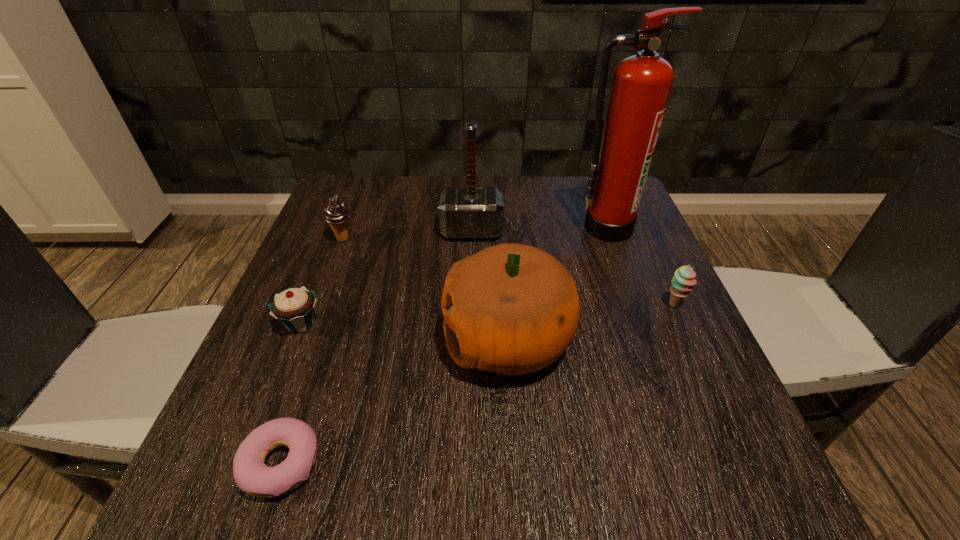
At what (x,y) coordinates should I click in order to perform the action: click on icecream situated at the left edge. Please return your answer as a coordinate pair (x, y). Looking at the image, I should click on (336, 214).

The image size is (960, 540). Find the location of `cupcake located in the left edge section of the desktop`. cupcake located in the left edge section of the desktop is located at coordinates (294, 307).

The image size is (960, 540). Find the location of `doughnut that is at the left edge`. doughnut that is at the left edge is located at coordinates (250, 473).

Locate an element on the screen. This screenshot has height=540, width=960. fire extinguisher that is at the right edge is located at coordinates (641, 85).

You are a GUI agent. You are given a task and a screenshot of the screen. Output one action in this format:
    pyautogui.click(x=<x>, y=<y>)
    Task: Click on the sherbert present at the right edge
    
    Given the screenshot: What is the action you would take?
    pyautogui.click(x=683, y=280)

Locate an element on the screen. object situated at the near left corner is located at coordinates (250, 473).

This screenshot has height=540, width=960. Find the location of `object that is at the far right corner`. object that is at the far right corner is located at coordinates (641, 85).

The width and height of the screenshot is (960, 540). In the image, there is a desktop. Identify the location of vacant area at the far edge. (517, 189).

Find the location of `blank space at the near edge`. blank space at the near edge is located at coordinates (543, 489).

Identify the location of free location at the left edge of the desktop. (311, 269).